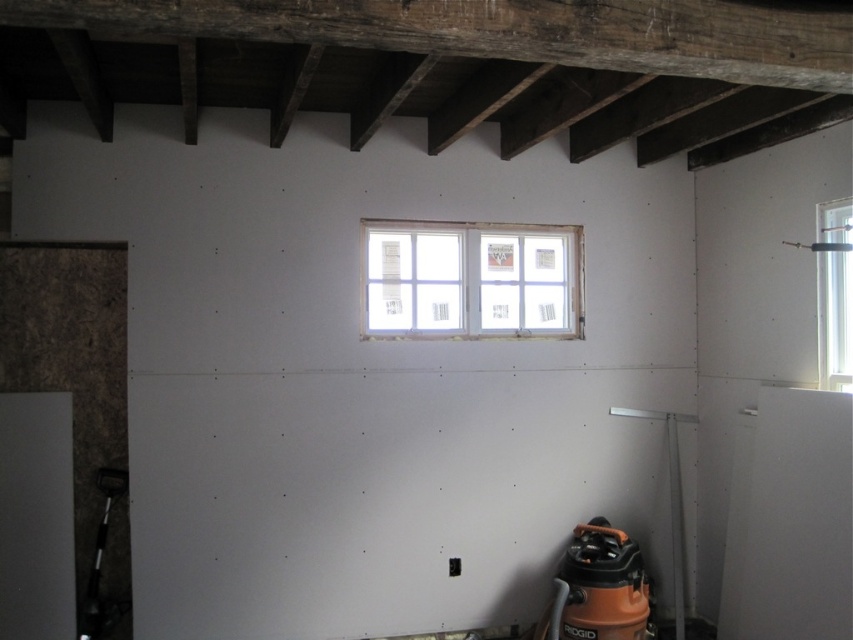
Question: Can you confirm if clear glass window at upper center is smaller than orange plastic vacuum cleaner at lower right?

Choices:
 (A) no
 (B) yes

Answer: (A)

Question: From the image, what is the correct spatial relationship of clear glass window at upper center in relation to clear glass window at upper right?

Choices:
 (A) left
 (B) right

Answer: (A)

Question: Considering the relative positions of orange plastic vacuum cleaner at lower right and clear glass window at upper right in the image provided, where is orange plastic vacuum cleaner at lower right located with respect to clear glass window at upper right?

Choices:
 (A) below
 (B) above

Answer: (A)

Question: Considering the real-world distances, which object is farthest from the clear glass window at upper right?

Choices:
 (A) orange plastic vacuum cleaner at lower right
 (B) clear glass window at upper center

Answer: (B)

Question: Which object is positioned closest to the orange plastic vacuum cleaner at lower right?

Choices:
 (A) clear glass window at upper right
 (B) clear glass window at upper center

Answer: (B)

Question: Which point appears farthest from the camera in this image?

Choices:
 (A) (842, 291)
 (B) (624, 609)

Answer: (B)